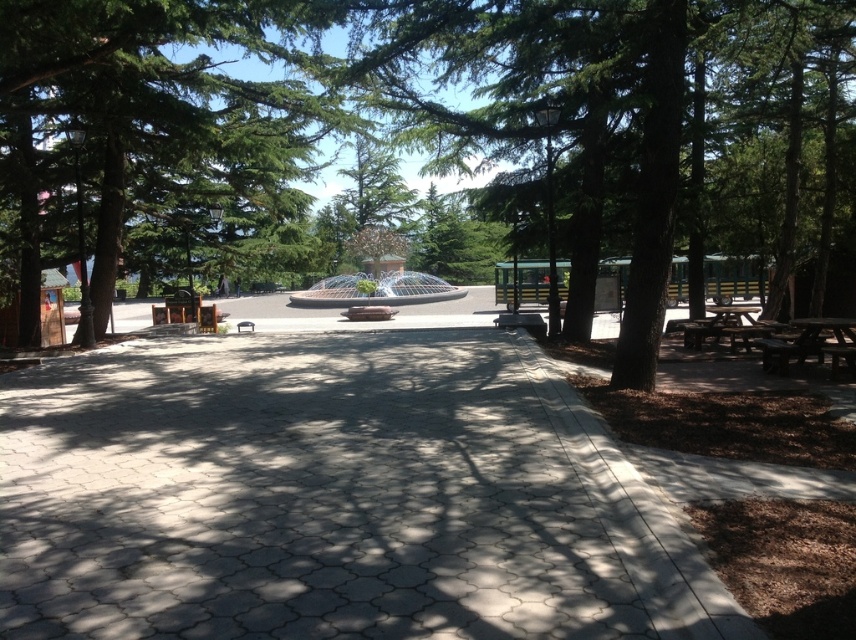
You are standing at the entrance of the park and want to reach the circular fountain. Which direction should you walk from the gray concrete pavement at center to get there?

The gray concrete pavement at center is located at point (331, 499). Since the fountain is in the midground near the pathway that curves around it, you should walk towards the fountain from the gray concrete pavement at center by moving towards the midground area where the fountain is situated.

You are planning to set up a picnic blanket between the green textured tree at center and the green leafy tree at center. Given that the recommended distance for a comfortable picnic setup is at least 15 feet between two trees, will this location work?

The green textured tree at center and green leafy tree at center are 20.28 feet apart from each other, which exceeds the recommended 15 feet distance. This location will work for a comfortable picnic setup.

You are planning to set up a small tent for a picnic. The tent requires a flat area that is wider than the brown wooden picnic table at lower right. Based on the scene, is the gray concrete pavement at center suitable for this purpose?

The gray concrete pavement at center might be wider than brown wooden picnic table at lower right, so it could be suitable for setting up the tent if the required width is met.